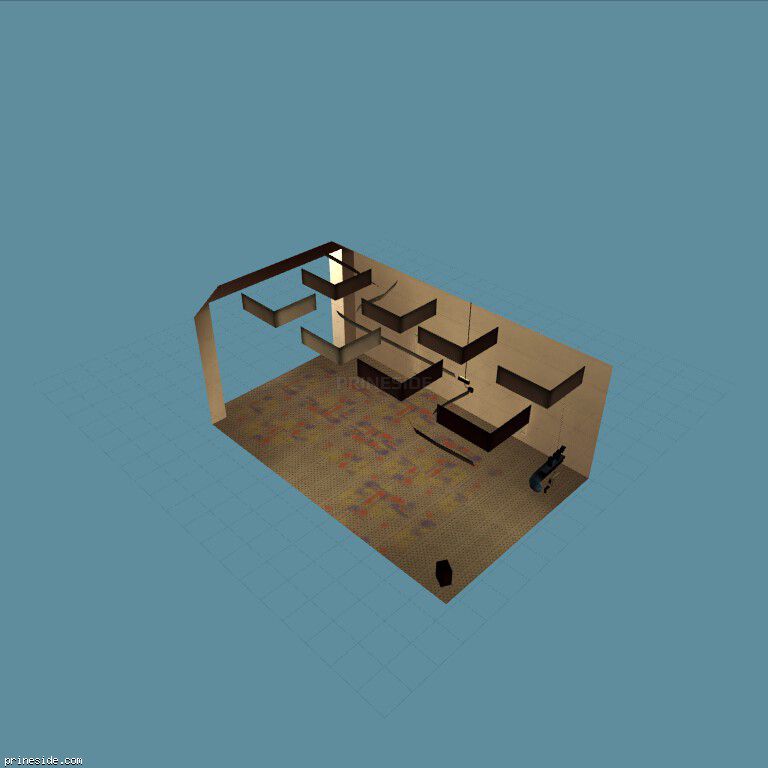
At what (x,y) coordinates should I click in order to perform the action: click on lights. Please return your answer as a coordinate pair (x, y). The image size is (768, 768). Looking at the image, I should click on (396, 385).